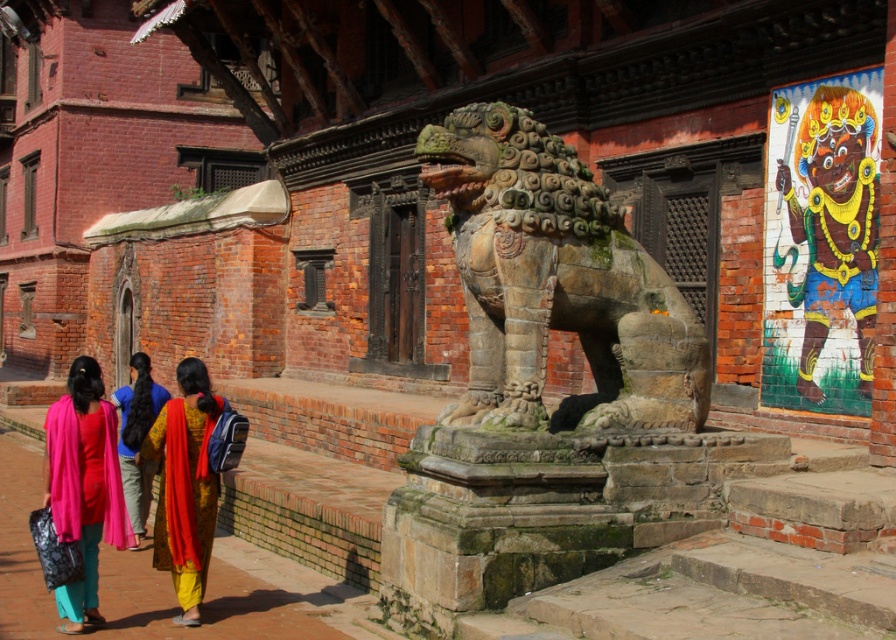
Does green stone lion at center have a smaller size compared to matte pink scarf at lower left?

Yes, green stone lion at center is smaller than matte pink scarf at lower left.

Who is shorter, green stone lion at center or matte pink scarf at lower left?

matte pink scarf at lower left is shorter.

Which is in front, point (636, 384) or point (59, 428)?

Point (59, 428) is more forward.

You are a GUI agent. You are given a task and a screenshot of the screen. Output one action in this format:
    pyautogui.click(x=<x>, y=<y>)
    Task: Click on the green stone lion at center
    
    Given the screenshot: What is the action you would take?
    pyautogui.click(x=556, y=282)

Does multicolored painted deity at upper right have a larger size compared to yellow silk saree at center?

No.

Describe the element at coordinates (834, 225) in the screenshot. This screenshot has width=896, height=640. I see `multicolored painted deity at upper right` at that location.

Measure the distance between multicolored painted deity at upper right and camera.

multicolored painted deity at upper right and camera are 16.01 meters apart.

Identify the location of multicolored painted deity at upper right. (834, 225).

Is multicolored painted deity at upper right positioned at the back of matte pink scarf at lower left?

Yes, multicolored painted deity at upper right is further from the viewer.

Can you confirm if multicolored painted deity at upper right is shorter than matte pink scarf at lower left?

In fact, multicolored painted deity at upper right may be taller than matte pink scarf at lower left.

Is point (853, 257) in front of point (63, 419)?

That is False.

Where is `multicolored painted deity at upper right`? This screenshot has height=640, width=896. multicolored painted deity at upper right is located at coordinates (834, 225).